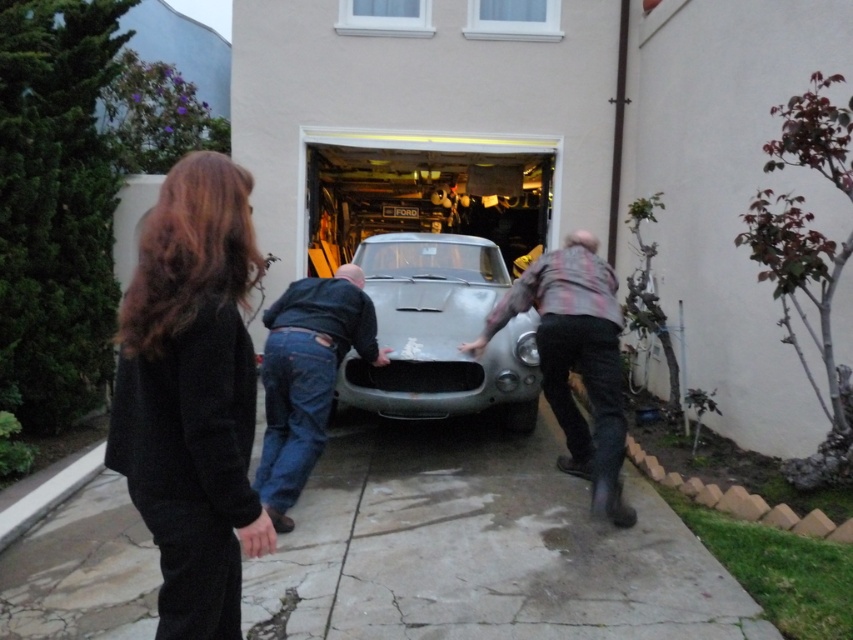
Question: Does concrete driveway at center come in front of flannel shirt at center?

Choices:
 (A) no
 (B) yes

Answer: (B)

Question: Is silver metallic car at center closer to the viewer compared to flannel shirt at center?

Choices:
 (A) yes
 (B) no

Answer: (B)

Question: Is silver metallic car at center to the left of matte black car at center from the viewer's perspective?

Choices:
 (A) yes
 (B) no

Answer: (B)

Question: Which point appears farthest from the camera in this image?

Choices:
 (A) (453, 388)
 (B) (318, 474)

Answer: (A)

Question: Which point is closer to the camera?

Choices:
 (A) (265, 541)
 (B) (556, 349)
 (C) (467, 630)

Answer: (A)

Question: Which point is farther to the camera?

Choices:
 (A) (206, 388)
 (B) (519, 506)

Answer: (B)